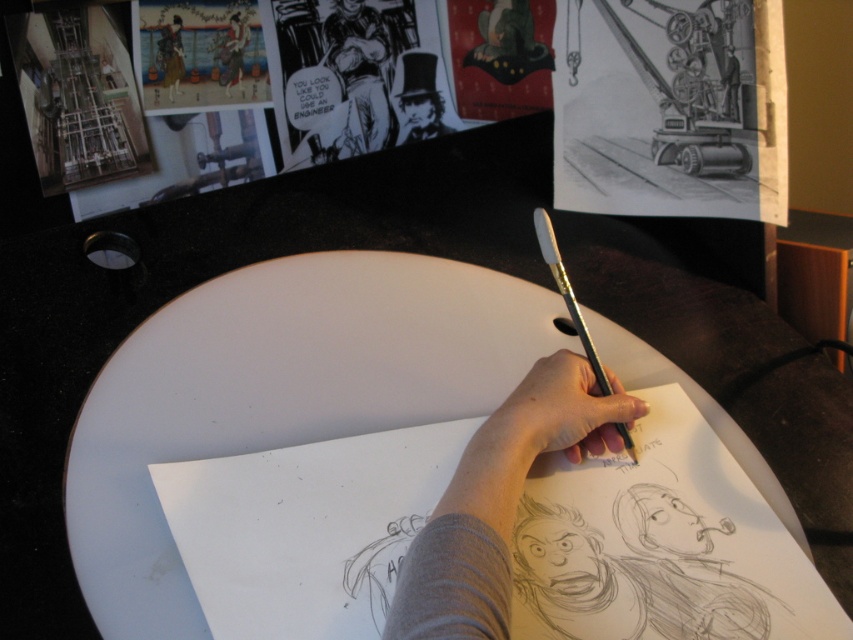
Question: Does smooth skin hand at center have a larger size compared to silk kimono at upper left?

Choices:
 (A) no
 (B) yes

Answer: (B)

Question: Is metallic silver pencil at center above silk kimono at upper left?

Choices:
 (A) yes
 (B) no

Answer: (B)

Question: Which is farther from the metallic silver pencil at center?

Choices:
 (A) matte black kimono at upper left
 (B) smooth skin hand at center
 (C) silk kimono at upper left
 (D) matte black top hat at upper center

Answer: (C)

Question: Which object is farther from the camera taking this photo?

Choices:
 (A) matte black top hat at upper center
 (B) metallic silver pencil at center
 (C) matte black kimono at upper left
 (D) smooth skin hand at center

Answer: (A)

Question: From the image, what is the correct spatial relationship of metallic silver pencil at center in relation to matte black kimono at upper left?

Choices:
 (A) left
 (B) right

Answer: (B)

Question: Which of the following is the farthest from the observer?

Choices:
 (A) (157, 92)
 (B) (224, 38)
 (C) (584, 349)
 (D) (532, 429)

Answer: (B)